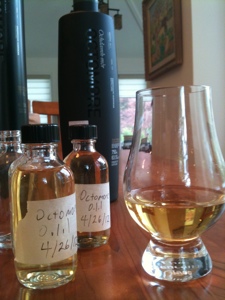
Image resolution: width=225 pixels, height=300 pixels. I want to click on masking tape, so click(37, 232).